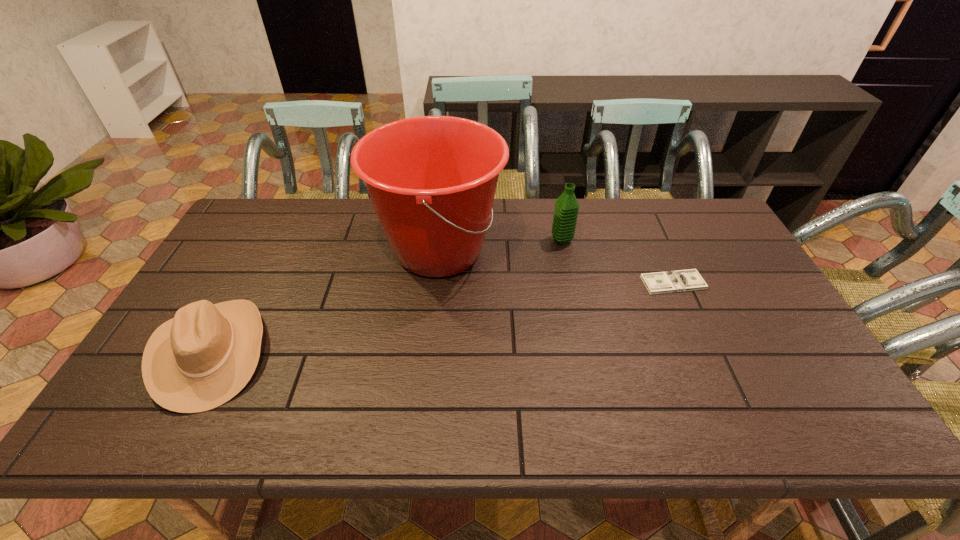
This screenshot has width=960, height=540. I want to click on the tallest object, so click(x=432, y=180).

I want to click on bucket, so click(x=432, y=180).

Where is `water bottle`? water bottle is located at coordinates (566, 209).

The width and height of the screenshot is (960, 540). In order to click on the third shortest object in this screenshot , I will do `click(566, 209)`.

Identify the location of the leftmost object. (204, 356).

Identify the location of the third tallest object. (204, 356).

The image size is (960, 540). Identify the location of dollar. (681, 280).

You are a GUI agent. You are given a task and a screenshot of the screen. Output one action in this format:
    pyautogui.click(x=<x>, y=<y>)
    Task: Click on the rightmost object
    The image size is (960, 540).
    Given the screenshot: What is the action you would take?
    pyautogui.click(x=681, y=280)

You are a GUI agent. You are given a task and a screenshot of the screen. Output one action in this format:
    pyautogui.click(x=<x>, y=<y>)
    Task: Click on the vacant space located with the handle attached to the rim of the second object from left to right
    This screenshot has height=540, width=960.
    Given the screenshot: What is the action you would take?
    pyautogui.click(x=593, y=251)

Identify the location of vacant position located on the left of the third shortest object. The height and width of the screenshot is (540, 960). (499, 240).